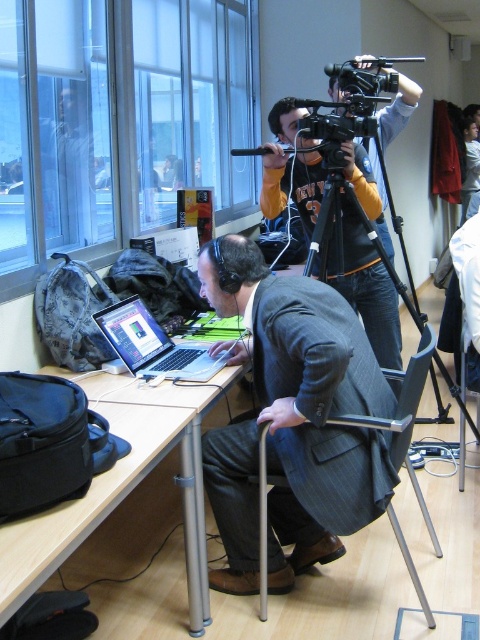
Question: Is dark gray pinstripe suit at center to the right of satin black laptop at center from the viewer's perspective?

Choices:
 (A) no
 (B) yes

Answer: (B)

Question: Which point appears closest to the camera in this image?

Choices:
 (A) (119, 321)
 (B) (383, 307)
 (C) (94, 493)
 (D) (410, 272)

Answer: (C)

Question: Which point is farther from the camera taking this photo?

Choices:
 (A) tap(414, 289)
 (B) tap(263, 552)

Answer: (A)

Question: Can you confirm if silver metallic table at center is smaller than black matte tripod at center?

Choices:
 (A) no
 (B) yes

Answer: (A)

Question: Is orange fleece sweatshirt at upper center below black matte tripod at center?

Choices:
 (A) no
 (B) yes

Answer: (A)

Question: Which point is closer to the camera?

Choices:
 (A) (460, 481)
 (B) (415, 483)
 (C) (370, 186)

Answer: (B)